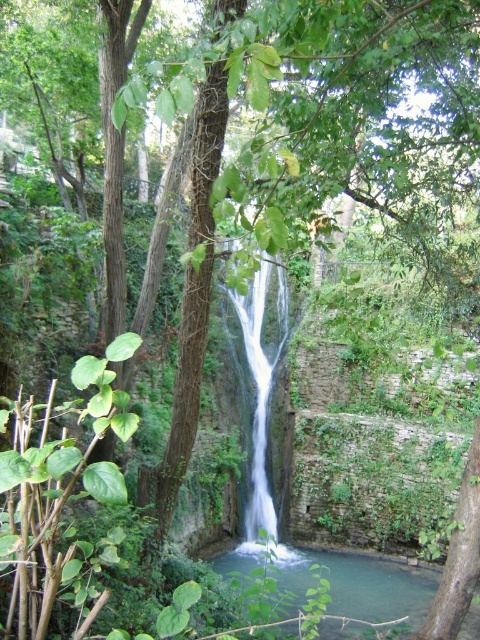
Question: Is clear water at center smaller than white smooth waterfall at center?

Choices:
 (A) no
 (B) yes

Answer: (B)

Question: Does clear water at center have a lesser width compared to white smooth waterfall at center?

Choices:
 (A) yes
 (B) no

Answer: (A)

Question: Which point is closer to the camera?

Choices:
 (A) (264, 356)
 (B) (360, 588)

Answer: (B)

Question: Among these points, which one is nearest to the camera?

Choices:
 (A) (420, 605)
 (B) (230, 291)

Answer: (A)

Question: Does clear water at center come in front of white smooth waterfall at center?

Choices:
 (A) no
 (B) yes

Answer: (A)